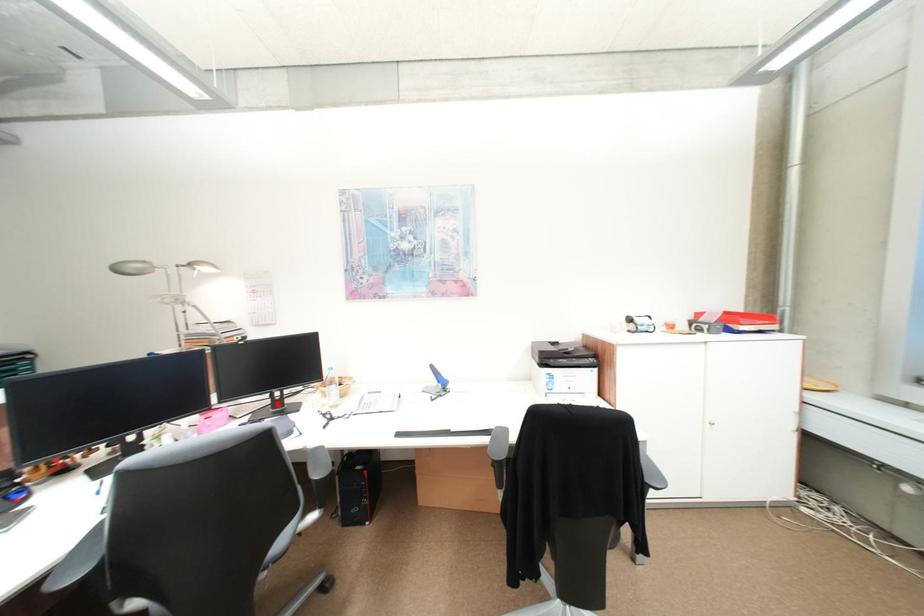
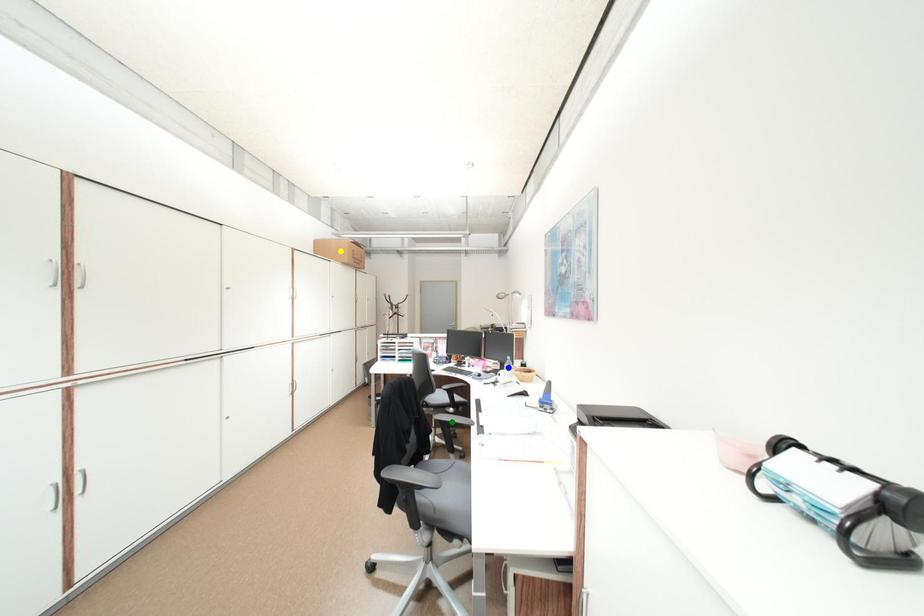
Question: I am providing you with two images of the same scene from different viewpoints. A red point is marked on the first image. You are given multiple points on the second image. Which point in image 2 represents the same 3d spot as the red point in image 1?

Choices:
 (A) yellow point
 (B) green point
 (C) blue point

Answer: (C)